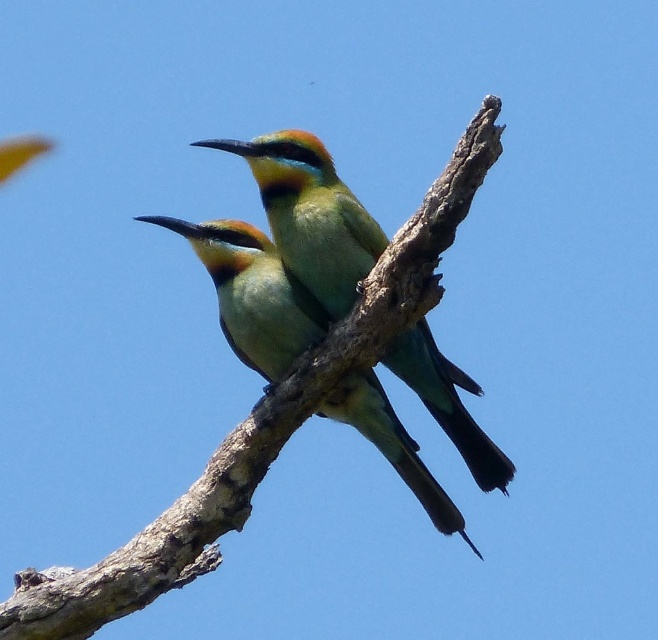
You are a birdwatcher standing on the ground looking at the brown rough branch at center where two bee eaters are perched. You have a camera with a 50mm lens. To get a close up shot of the birds, you need to be within 2 meters of the branch. Can you take the photo from your current position?

The brown rough branch at center is 2.53 meters away from the viewer. Since you need to be within 2 meters for a close up, you are too far away to take the photo with the 50mm lens from your current position.